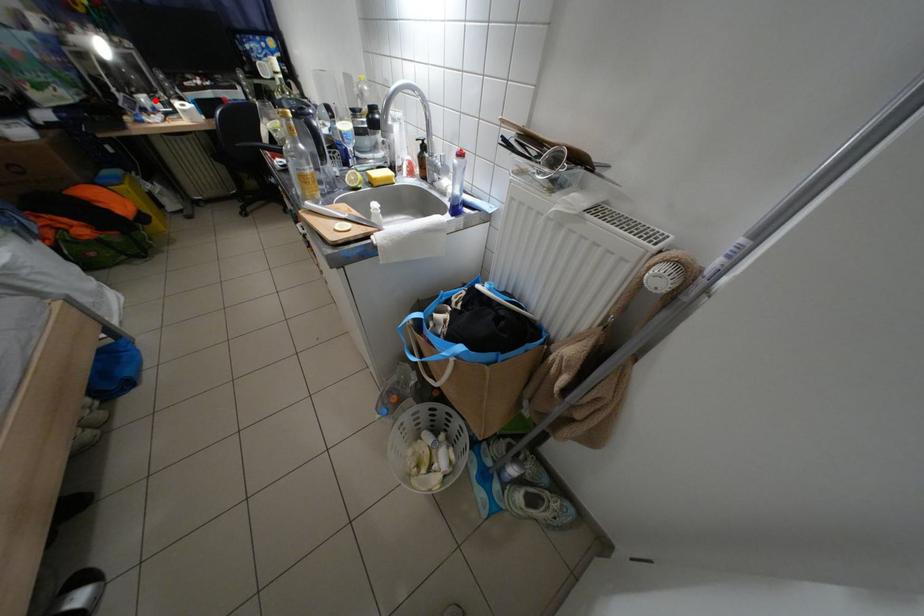
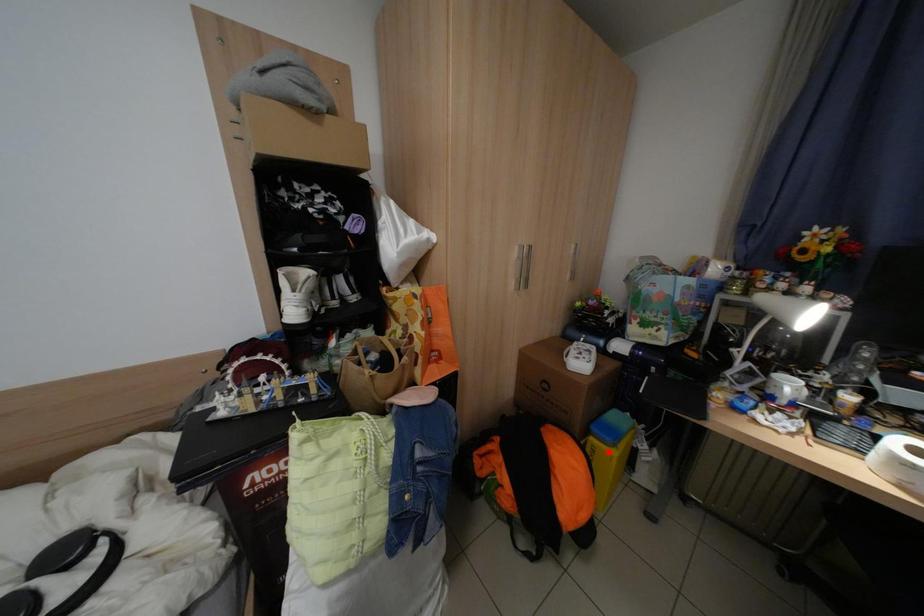
I am providing you with two images of the same scene from different viewpoints. A red point is marked on the first image and another point is marked on the second image. Do the highlighted points in image1 and image2 indicate the same real-world spot?

No